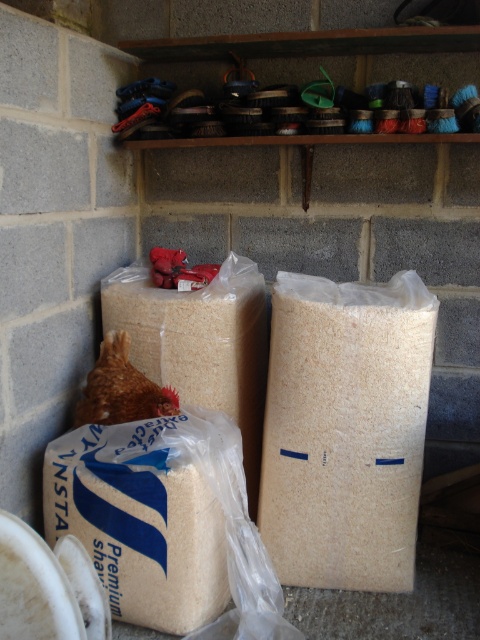
You are a farmer who needs to store a brown feathered chicken at lower left in a bag. You have a white matte paper bag at center available. Based on their sizes, will the chicken fit inside the bag?

The white matte paper bag at center is larger in size than the brown feathered chicken at lower left, so the chicken should fit inside the bag.

You are a farmer who needs to reach the white matte paper bag at center and the brown feathered chicken at lower left. Which object is closer to you?

The white matte paper bag at center is closer to the viewer than the brown feathered chicken at lower left, so the white matte paper bag at center is closer.

You are a farmer who needs to place the white matte paper bag at center and the brown feathered chicken at lower left into separate containers. Which object should be placed to the left of the other to maintain their current spatial arrangement?

The brown feathered chicken at lower left should be placed to the left of the white matte paper bag at center to maintain their current spatial arrangement since the white matte paper bag at center is currently on the right side of the brown feathered chicken at lower left.